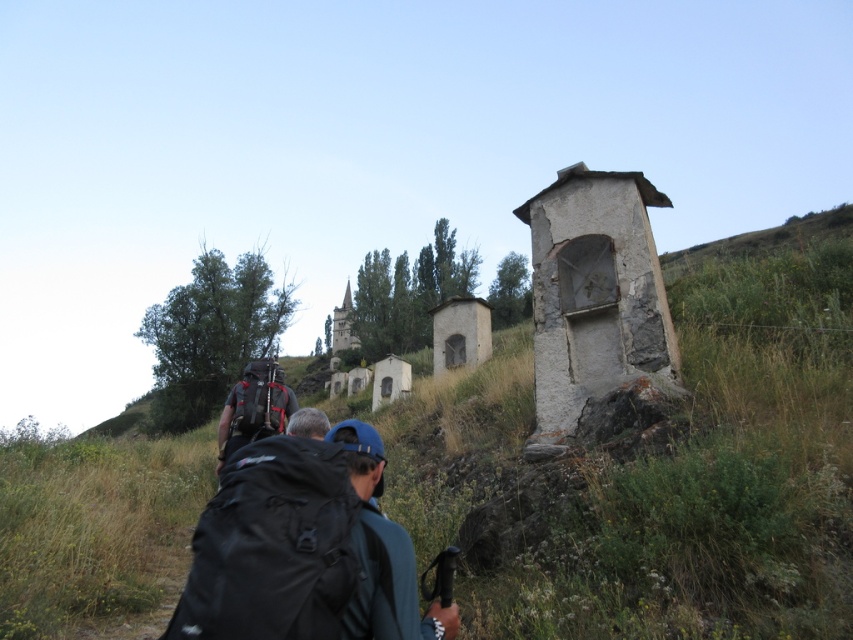
You are a hiker trying to navigate between the two chapels in the scene. Which direction should you go from the white stone chapel at center to reach the smooth stone chapel at center?

The smooth stone chapel at center is located above the white stone chapel at center, so you should go upwards to reach it.

Based on the photo, you are a hiker trying to decide which of the two chapels to visit first. The white stone chapel at center and the smooth stone chapel at center are both in your path. Based on their sizes, which one should you choose if you want to explore the smaller one first?

The white stone chapel at center occupies less space than smooth stone chapel at center, so you should visit the white stone chapel at center first to explore the smaller one.

You are a hiker trying to take a photo of the smooth stone chapel at center without the white stone chapel at center blocking the view. Can you move to the right side of the path to get a clear shot?

The white stone chapel at center is in front of the smooth stone chapel at center, so moving to the right side of the path may not help as the white stone chapel is still blocking the view. You might need to go around or find a higher vantage point.